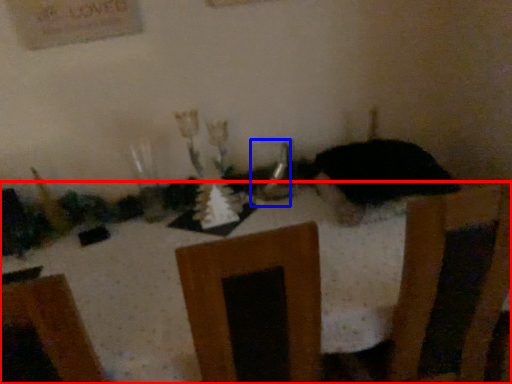
Question: Which object appears closest to the camera in this image, furniture (highlighted by a red box) or tableware (highlighted by a blue box)?

Choices:
 (A) furniture
 (B) tableware

Answer: (A)